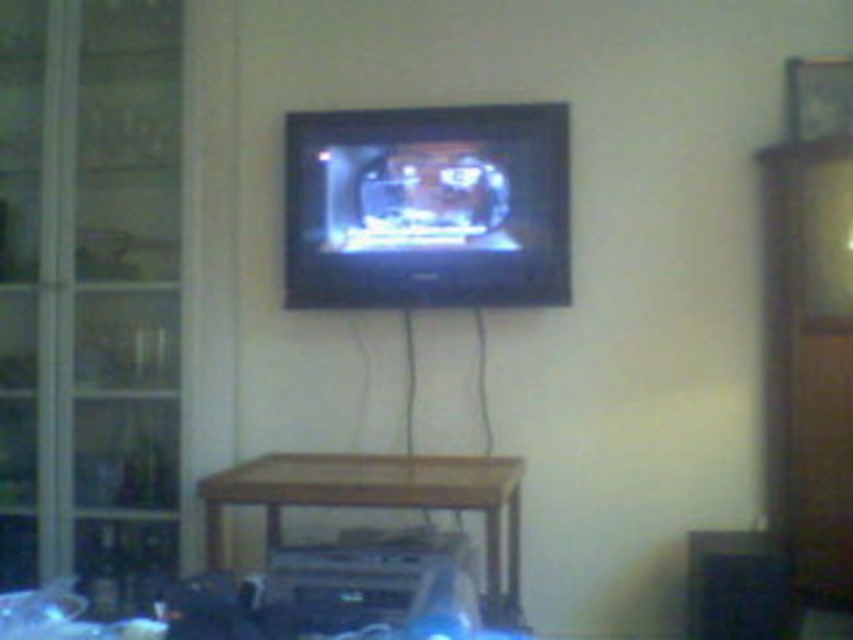
You are standing in the living room depicted in the image. You want to place a new decorative item on the console table below the TV. The console table is located at point (x=427, y=205). Where exactly should you place the item to ensure it is centered on the table?

The matte black flat screen tv at center is located at point (x=427, y=205). To center the decorative item on the console table below the TV, you should place it at the same coordinates, (x=427, y=205), as the table is directly under the TV.

You are planning to move the matte black flat screen tv at center to the wooden table at lower center. Considering their sizes, will the tv fit on the table without overhanging the edges?

The matte black flat screen tv at center occupies less space than wooden table at lower center, so it will fit on the table without overhanging the edges.